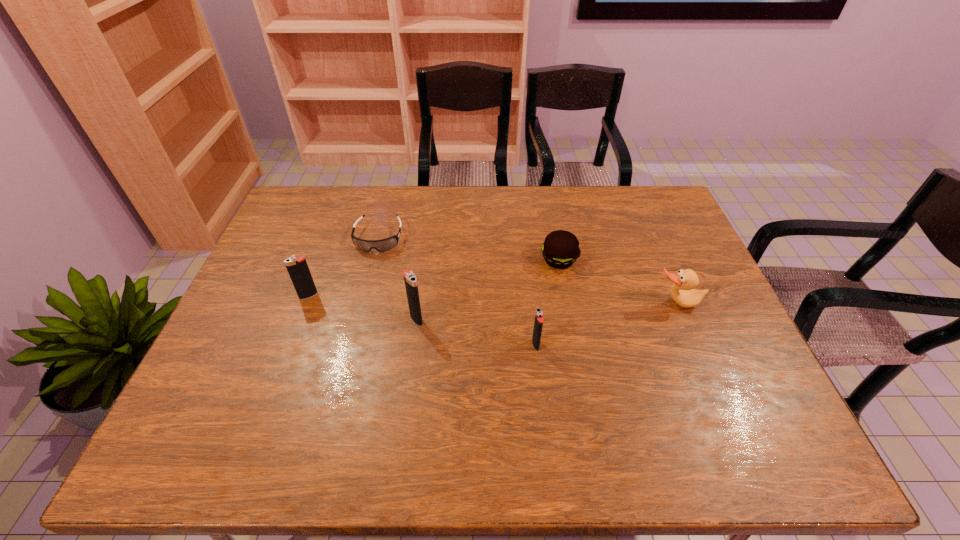
The image size is (960, 540). I want to click on the closest igniter to the leftmost object, so click(410, 279).

The height and width of the screenshot is (540, 960). Find the location of `free location that satisfies the following two spatial constraints: 1. on the front side of the second nearest igniter; 2. on the left side of the leftmost igniter`. free location that satisfies the following two spatial constraints: 1. on the front side of the second nearest igniter; 2. on the left side of the leftmost igniter is located at coordinates (300, 319).

This screenshot has height=540, width=960. In order to click on free point that satisfies the following two spatial constraints: 1. on the front and sides of the shortest object; 2. on the left side of the second igniter from right to left in this screenshot , I will do `click(358, 319)`.

Locate an element on the screen. This screenshot has width=960, height=540. free space that satisfies the following two spatial constraints: 1. on the front and sides of the shortest object; 2. on the right side of the shortest igniter is located at coordinates (351, 345).